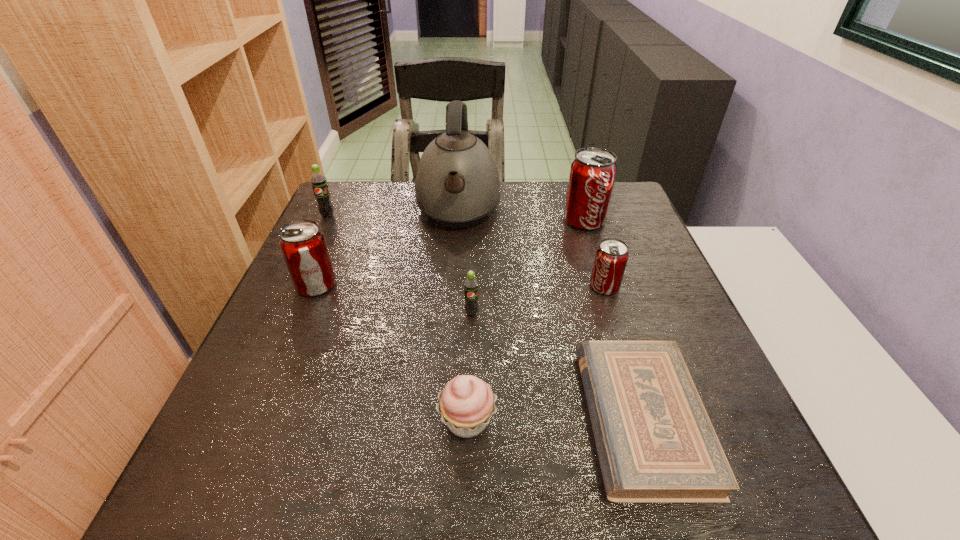
Where is `red pop soda that is the second closest one to the farthest red pop soda`? red pop soda that is the second closest one to the farthest red pop soda is located at coordinates (303, 245).

Where is `vacant region that satisfies the following two spatial constraints: 1. on the front label of the left green soda; 2. on the right side of the leftmost red pop soda`? This screenshot has height=540, width=960. vacant region that satisfies the following two spatial constraints: 1. on the front label of the left green soda; 2. on the right side of the leftmost red pop soda is located at coordinates (295, 285).

You are a GUI agent. You are given a task and a screenshot of the screen. Output one action in this format:
    pyautogui.click(x=<x>, y=<y>)
    Task: Click on the free region that satisfies the following two spatial constraints: 1. on the front label of the left green soda; 2. on the right side of the biggest red pop soda
    The height and width of the screenshot is (540, 960).
    Given the screenshot: What is the action you would take?
    pyautogui.click(x=325, y=220)

Identify the location of blank area in the image that satisfies the following two spatial constraints: 1. at the spout of the kettle; 2. on the right side of the cupcake. (444, 420).